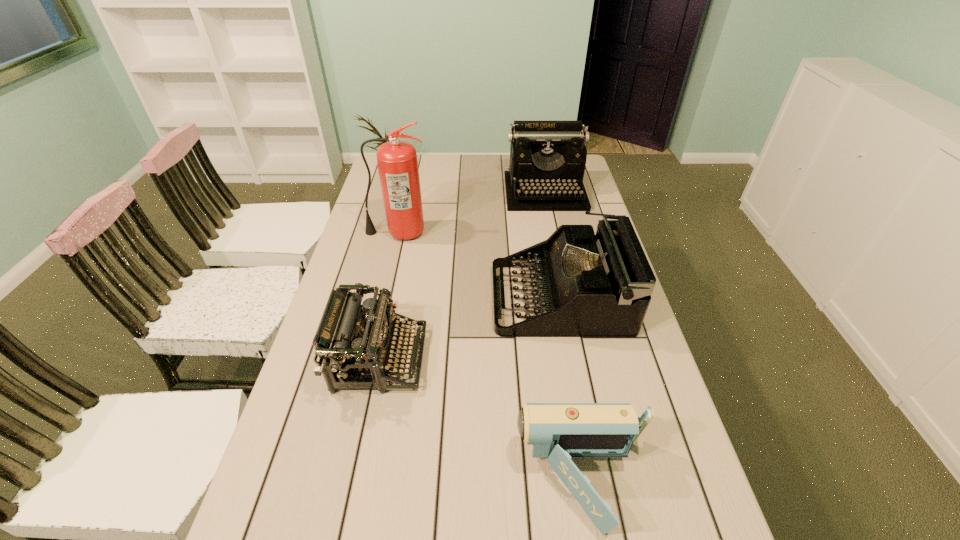
The image size is (960, 540). I want to click on typewriter that is at the left edge, so click(349, 344).

What are the coordinates of `object at the far right corner` in the screenshot? It's located at (547, 158).

The image size is (960, 540). Find the location of `free space at the far edge of the desktop`. free space at the far edge of the desktop is located at coordinates (460, 156).

Identify the location of vacant space at the left edge of the desktop. The width and height of the screenshot is (960, 540). pyautogui.click(x=317, y=485).

Identify the location of vacant area at the right edge of the desktop. (592, 209).

At what (x,y) coordinates should I click in order to perform the action: click on free space that is in between the shortest typewriter and the tallest typewriter. Please return your answer as a coordinate pair (x, y). Image resolution: width=960 pixels, height=540 pixels. Looking at the image, I should click on (463, 275).

Find the location of a particular element. vacant space that is in between the tallest object and the tallest typewriter is located at coordinates (471, 212).

Select which object appears as the third closest to the leftmost typewriter. Please provide its 2D coordinates. Your answer should be formatted as a tuple, i.e. [(x, y)], where the tuple contains the x and y coordinates of a point satisfying the conditions above.

[(397, 161)]

Point out which object is positioned as the second nearest to the tallest typewriter. Please provide its 2D coordinates. Your answer should be formatted as a tuple, i.e. [(x, y)], where the tuple contains the x and y coordinates of a point satisfying the conditions above.

[(588, 285)]

Identify the location of typewriter that stands as the closest to the leftmost typewriter. This screenshot has height=540, width=960. (588, 285).